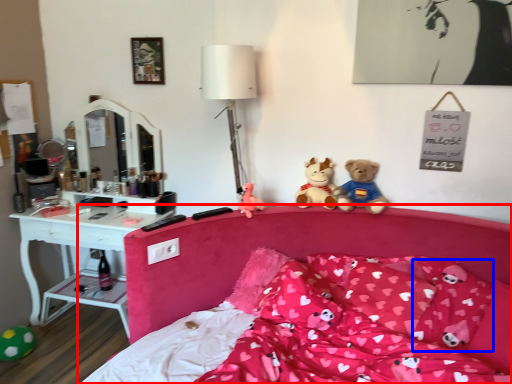
Question: Among these objects, which one is farthest to the camera, bed (highlighted by a red box) or pillow (highlighted by a blue box)?

Choices:
 (A) bed
 (B) pillow

Answer: (B)